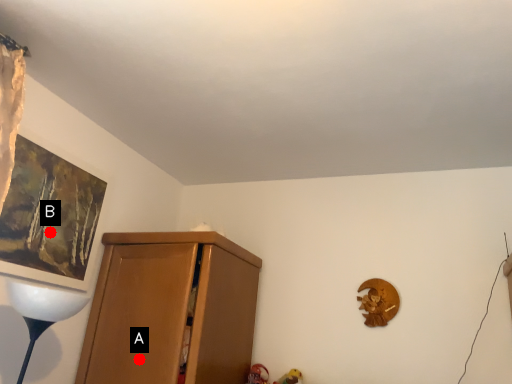
Question: Two points are circled on the image, labeled by A and B beside each circle. Among these points, which one is farthest from the camera?

Choices:
 (A) A is further
 (B) B is further

Answer: (B)